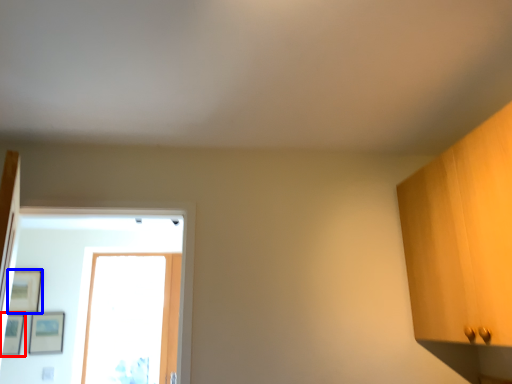
Question: Which of the following is the farthest to the observer, picture frame (highlighted by a red box) or picture frame (highlighted by a blue box)?

Choices:
 (A) picture frame
 (B) picture frame

Answer: (B)